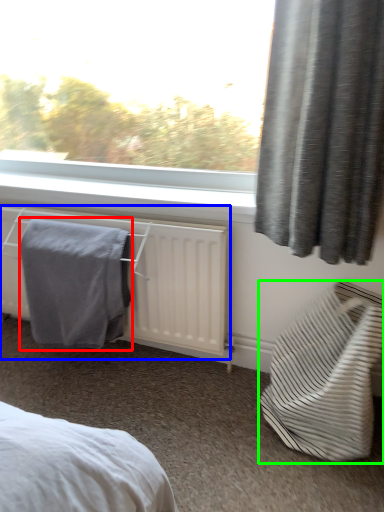
Question: Considering the real-world distances, which object is farthest from bath towel (highlighted by a red box)? radiator (highlighted by a blue box) or furniture (highlighted by a green box)?

Choices:
 (A) radiator
 (B) furniture

Answer: (B)